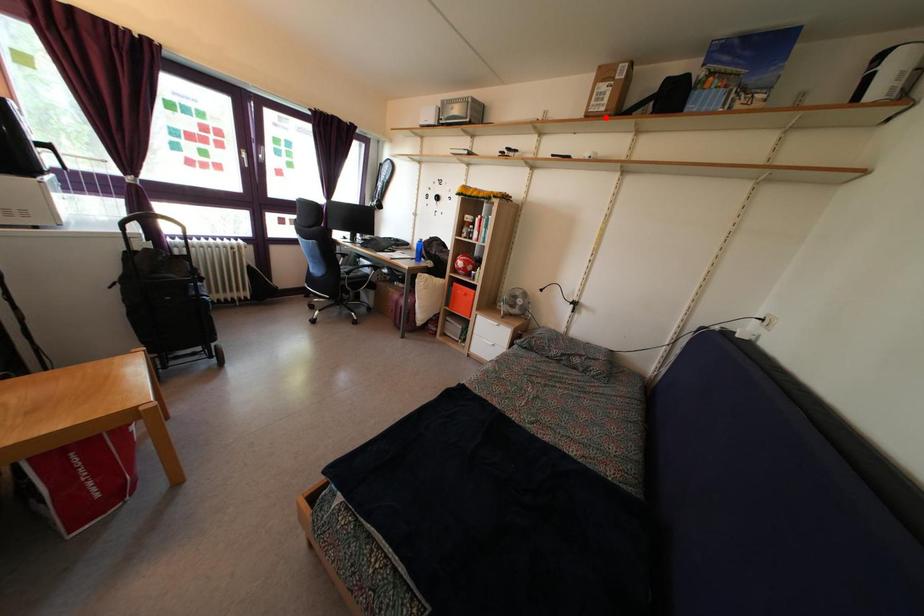
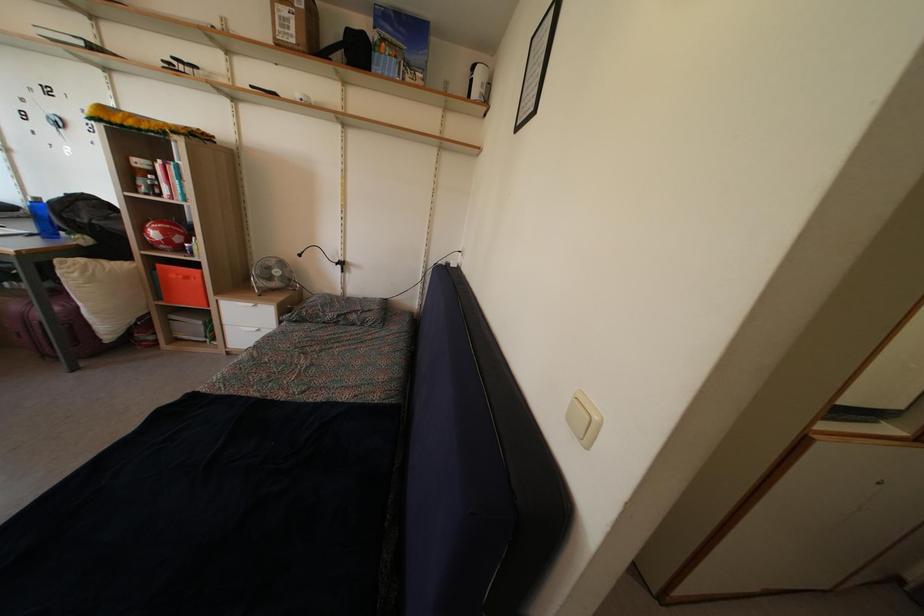
Locate, in the second image, the point that corresponds to the highlighted location in the first image.

(296, 50)